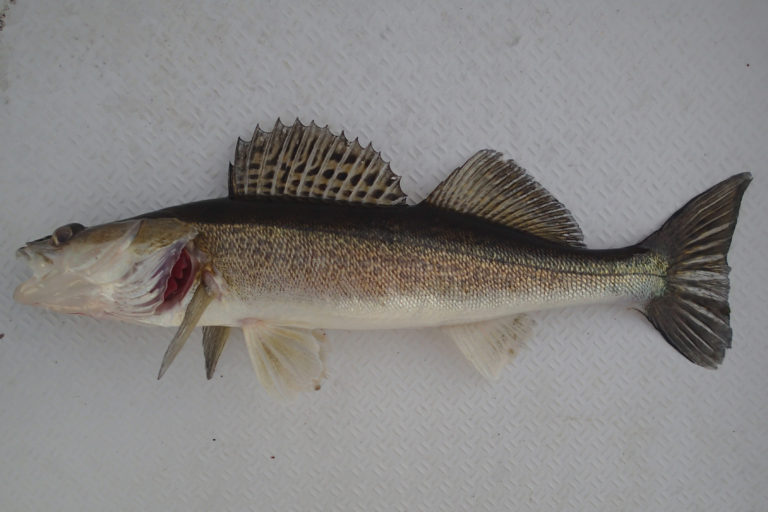
Where is `table fish is laying on`? Image resolution: width=768 pixels, height=512 pixels. table fish is laying on is located at coordinates (399, 404).